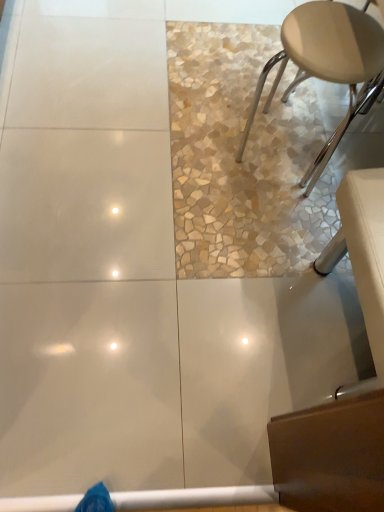
The width and height of the screenshot is (384, 512). What do you see at coordinates (326, 63) in the screenshot? I see `beige leather stool at right` at bounding box center [326, 63].

Identify the location of beige leather stool at right. This screenshot has height=512, width=384. (326, 63).

Identify the location of beige leather stool at right. click(326, 63).